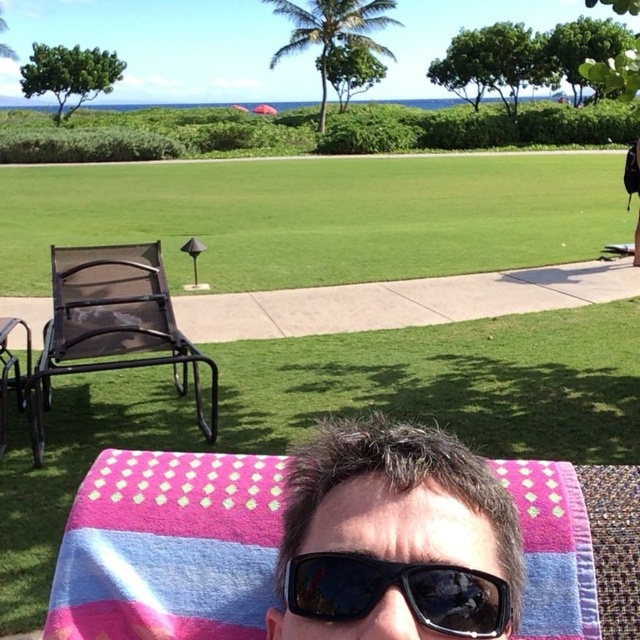
You are standing at the camera position and want to grab a drink from the table behind the matte black lounge chair at left. Can you reach it without moving your feet?

The matte black lounge chair at left is 3.58 meters away from the camera. Since the table is behind the chair, it is further away than 3.58 meters. Unless you have an exceptionally long reach, you likely cannot reach the drink without moving your feet.

Based on the photo, what is located at the coordinates point (317, 216)?

The coordinates point (317, 216) is occupied by green grass at center.

Based on the photo, you are planning to walk from the lounge area to the garden. You see the green grass at center and the black mesh chair at left. Which object is closer to your current position?

The green grass at center is closer to your current position because the black mesh chair at left is behind it.